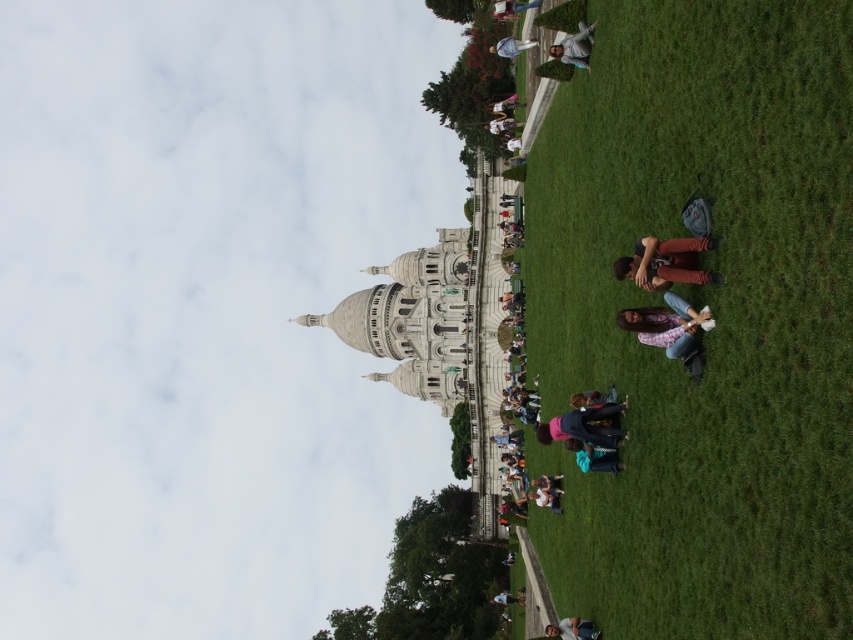
Question: Which object is closer to the camera taking this photo?

Choices:
 (A) blue denim jeans at lower center
 (B) light brown leather jacket at center

Answer: (B)

Question: Does white stone dome at center appear under floral shirt at lower center?

Choices:
 (A) no
 (B) yes

Answer: (B)

Question: Which point is farther to the camera?

Choices:
 (A) (463, 292)
 (B) (668, 337)

Answer: (A)

Question: Is the position of brown leather jacket at lower right less distant than that of white cotton shirt at center?

Choices:
 (A) no
 (B) yes

Answer: (B)

Question: Does green grass at lower right have a smaller size compared to brown leather jacket at lower right?

Choices:
 (A) yes
 (B) no

Answer: (B)

Question: Which is nearer to the denim pants at upper center?

Choices:
 (A) blue denim jeans at lower center
 (B) brown leather jacket at lower right
 (C) green grass at lower right

Answer: (C)